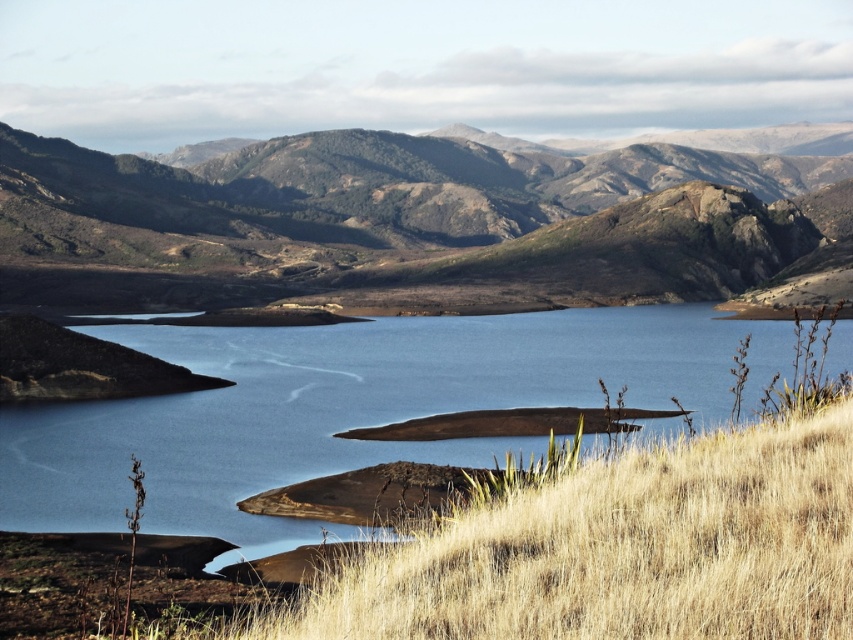
You are a photographer planning to capture the rugged brown mountain at center and the blue water at center in a single frame. Based on their sizes in the image, which object should you focus on to ensure both are clearly visible?

The rugged brown mountain at center might be wider than blue water at center, so focusing on the mountain would help ensure both are visible as they are positioned centrally and the mountain may occupy more space.

You are standing at the point with coordinates point (183, 483) and want to walk to the point with coordinates point (646, 161). Based on the scene, will you be moving towards the foreground or the background?

Since point (646, 161) is behind point (183, 483), moving from point (183, 483) to point (646, 161) means you are moving towards the background.